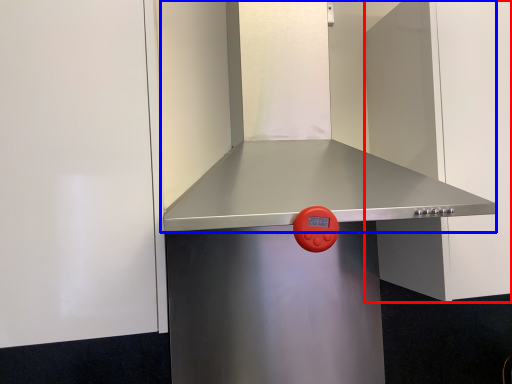
Question: Which object is closer to the camera taking this photo, door (highlighted by a red box) or vent (highlighted by a blue box)?

Choices:
 (A) door
 (B) vent

Answer: (B)